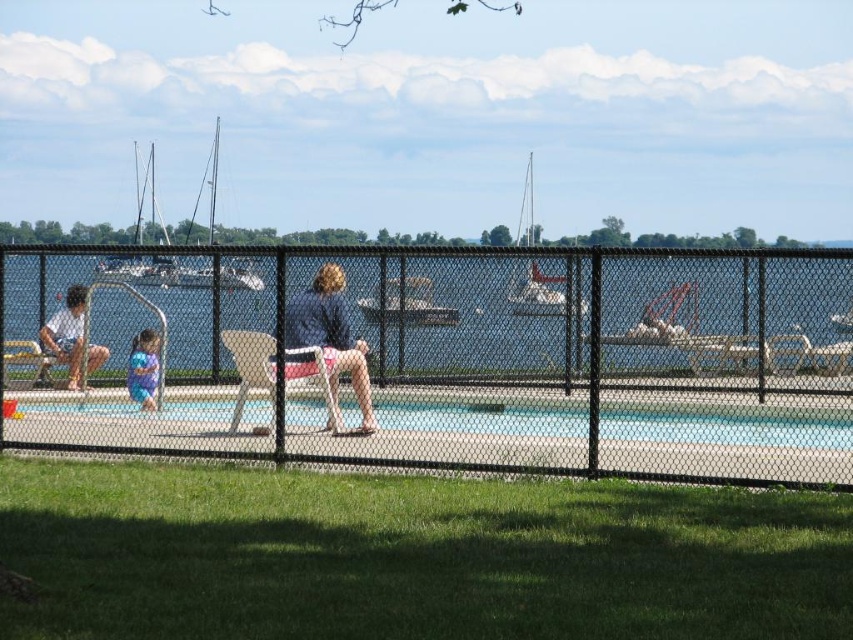
You are standing on the grassy lawn and want to see both the white sailboat at left and the matte purple swimsuit at left. Which object is closer to you?

The white sailboat at left is closer to you because it is in front of the matte purple swimsuit at left.

You are standing on the grassy lawn and want to see both the white sailboat at left and the matte purple swimsuit at left. Which object will appear taller to you?

The white sailboat at left is taller than the matte purple swimsuit at left, so it will appear taller to you.

You are standing at the edge of the swimming pool and want to reach both points marked in the image. Which point, point (387,416) or point (134,365), is closer to you?

Point (387,416) is closer to the camera than point (134,365), so it is closer to you.